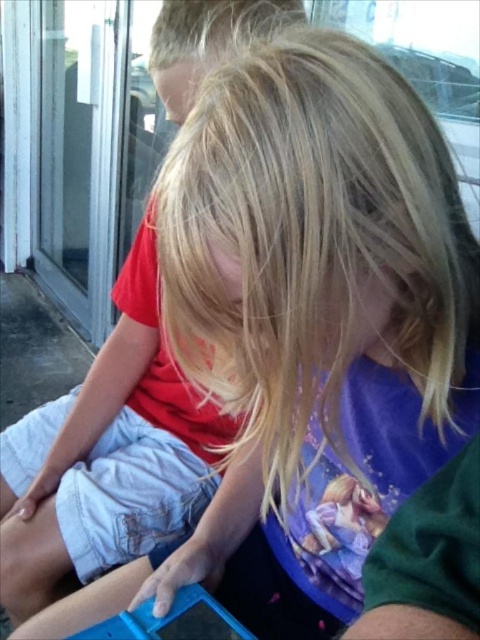
Question: Does transparent glass door at left have a larger size compared to blue plastic toy at lower center?

Choices:
 (A) no
 (B) yes

Answer: (B)

Question: Which object is farther from the camera taking this photo?

Choices:
 (A) blue plastic toy at lower center
 (B) transparent glass door at left

Answer: (B)

Question: Can you confirm if transparent glass door at left is smaller than blue plastic toy at lower center?

Choices:
 (A) yes
 (B) no

Answer: (B)

Question: Is transparent glass door at left in front of blue plastic toy at lower center?

Choices:
 (A) yes
 (B) no

Answer: (B)

Question: Which point is farther to the camera?

Choices:
 (A) transparent glass door at left
 (B) blue plastic toy at lower center

Answer: (A)